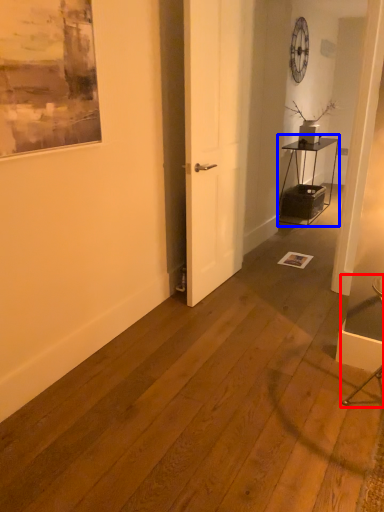
Question: Which object appears farthest to the camera in this image, armchair (highlighted by a red box) or table (highlighted by a blue box)?

Choices:
 (A) armchair
 (B) table

Answer: (B)